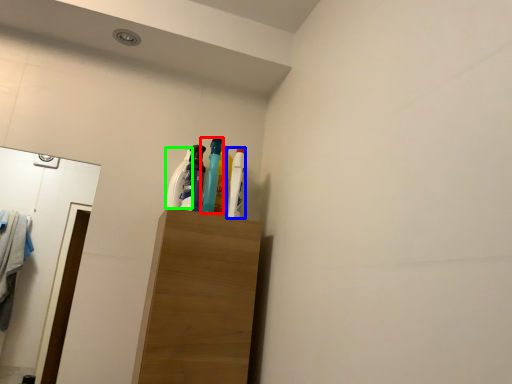
Question: Considering the real-world distances, which object is closest to bottle (highlighted by a red box)? bottle (highlighted by a blue box) or cleaning product (highlighted by a green box).

Choices:
 (A) bottle
 (B) cleaning product

Answer: (A)